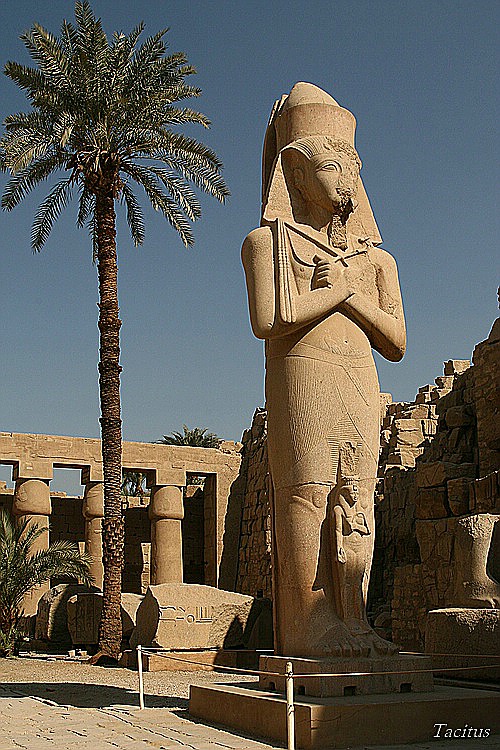
Identify the location of pedestal. (364, 724).